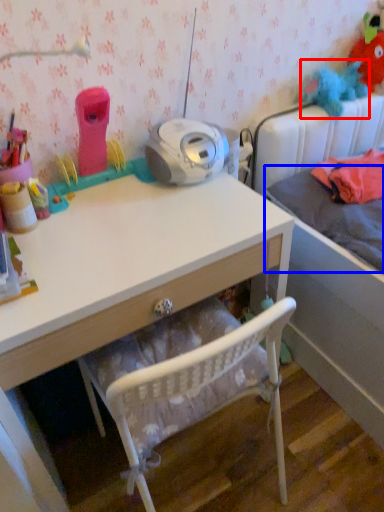
Question: Among these objects, which one is farthest to the camera, toy (highlighted by a red box) or mattress (highlighted by a blue box)?

Choices:
 (A) toy
 (B) mattress

Answer: (A)